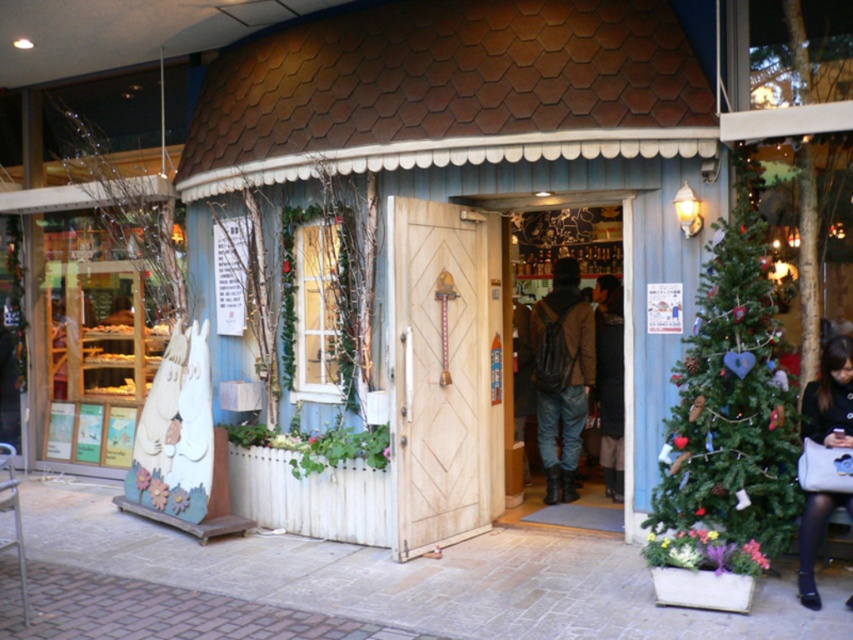
You are a customer entering the shop and see the wooden door at center and the brown leather jacket at center. Which object is closer to you as you approach the entrance?

The brown leather jacket at center is closer to you because the wooden door at center is positioned over it, indicating the jacket is behind the door.